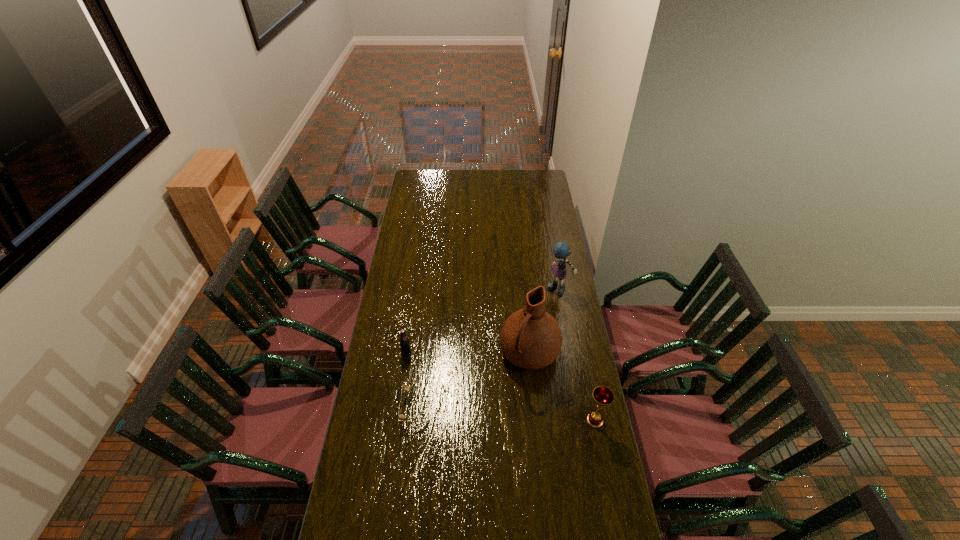
Where is `free space located on the side of the tallest object with the handle`? The image size is (960, 540). free space located on the side of the tallest object with the handle is located at coordinates (491, 417).

Find the location of a particular element. Image resolution: width=960 pixels, height=540 pixels. vacant space situated 0.310m on the front-facing side of the fourth shortest object is located at coordinates (528, 341).

Where is `vacant space situated 0.360m on the front-facing side of the fourth shortest object`? This screenshot has height=540, width=960. vacant space situated 0.360m on the front-facing side of the fourth shortest object is located at coordinates (523, 349).

I want to click on free location located on the front-facing side of the fourth shortest object, so click(x=542, y=317).

I want to click on vacant space positioned 0.130m on the front label of the pop, so click(x=431, y=373).

Identify the location of vacant region located 0.200m on the front label of the pop. The height and width of the screenshot is (540, 960). (444, 382).

Where is `vacant space positioned on the front label of the pop`? This screenshot has height=540, width=960. vacant space positioned on the front label of the pop is located at coordinates (428, 370).

Where is `sunglasses that is positioned at the left edge`? Image resolution: width=960 pixels, height=540 pixels. sunglasses that is positioned at the left edge is located at coordinates (401, 417).

Find the location of a particular element. Image resolution: width=960 pixels, height=540 pixels. pop that is positioned at the left edge is located at coordinates (404, 342).

Locate an element on the screen. chalice located at the right edge is located at coordinates (603, 396).